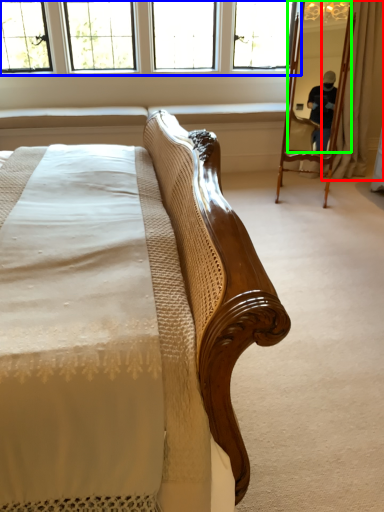
Question: Considering the real-world distances, which object is farthest from curtain (highlighted by a red box)? window (highlighted by a blue box) or mirror (highlighted by a green box)?

Choices:
 (A) window
 (B) mirror

Answer: (A)